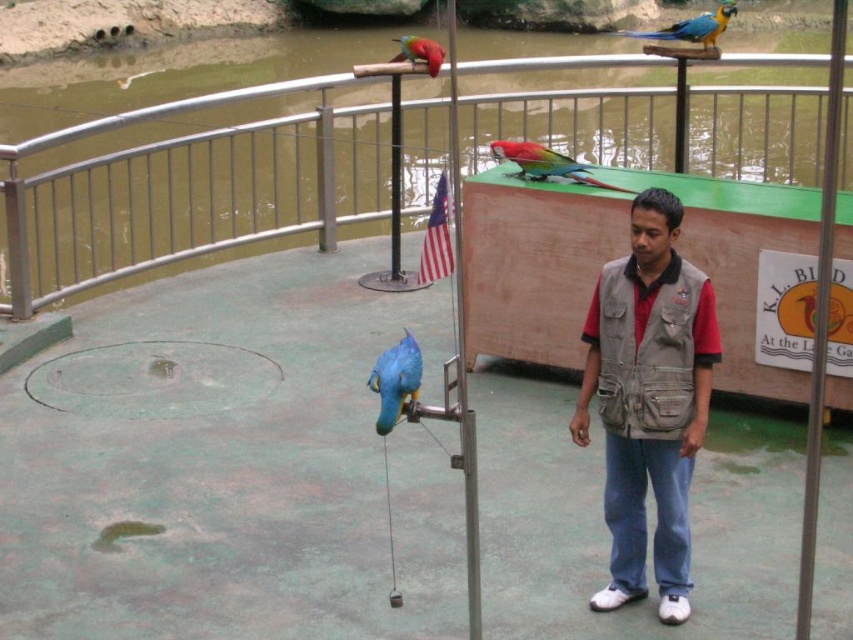
You are a visitor at the zoo trying to locate the brushed metal rail. According to the map, your current position is at point (190, 198). Can you see the brushed metal rail from your current position?

Yes, the brushed metal rail is located exactly at your current position at point (190, 198), so you are standing right next to it.